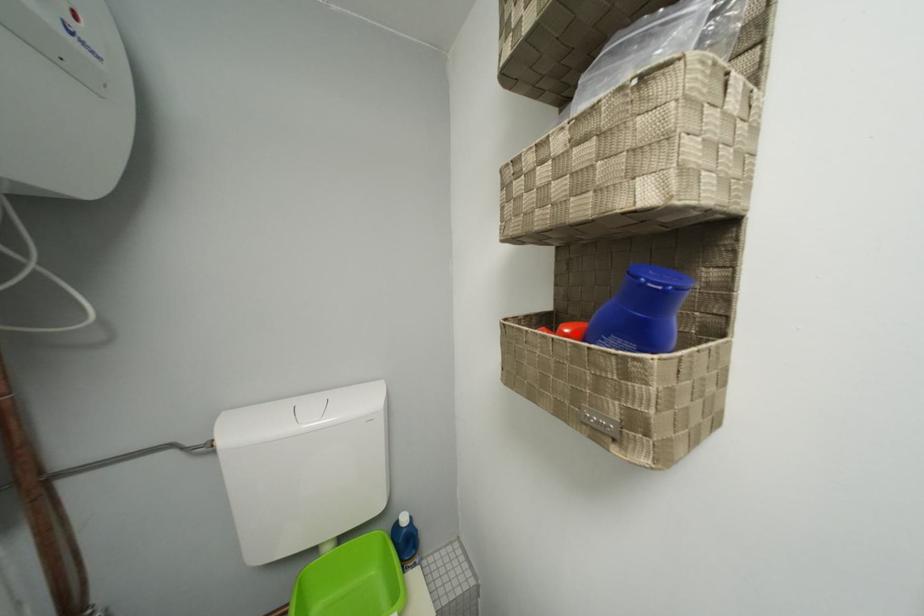
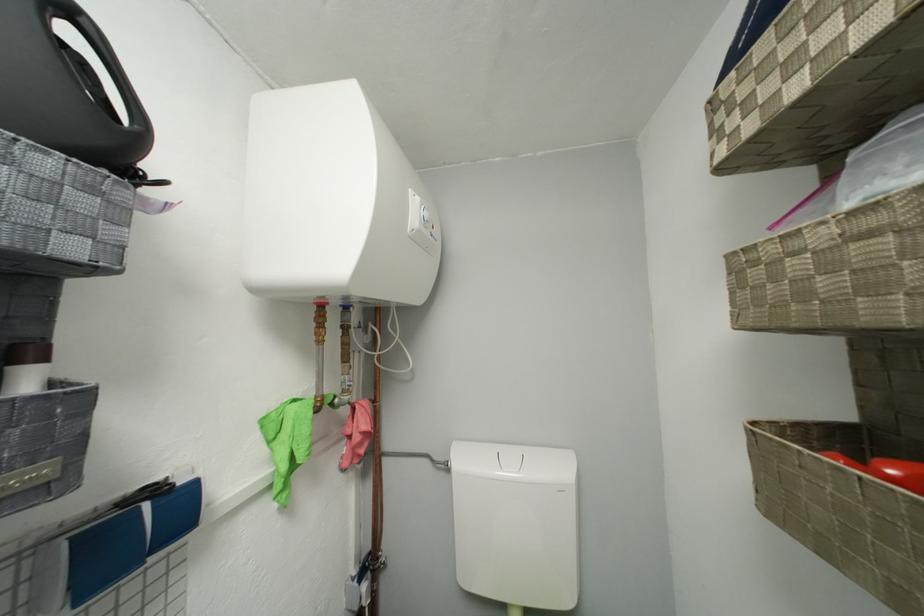
Locate, in the second image, the point that corresponds to the highlighted location in the first image.

(903, 475)